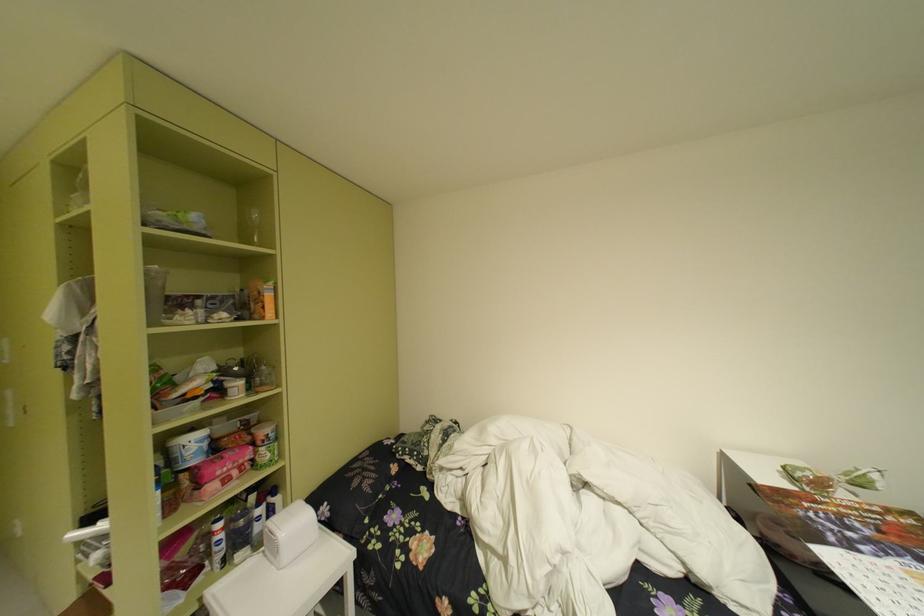
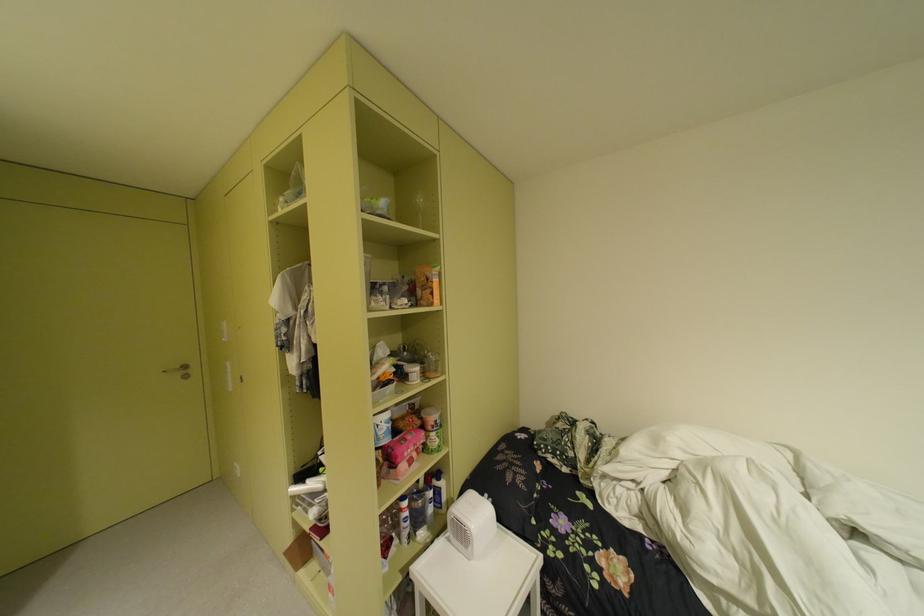
Where in the second image is the point corresponding to [262,390] from the first image?

(434, 376)